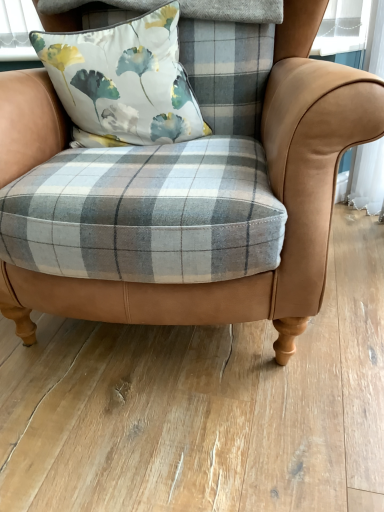
Question: Relative to matte plaid fabric chair at center, is floral fabric cushion at upper center in front or behind?

Choices:
 (A) behind
 (B) front

Answer: (A)

Question: From a real-world perspective, relative to matte plaid fabric chair at center, is floral fabric cushion at upper center vertically above or below?

Choices:
 (A) above
 (B) below

Answer: (A)

Question: In terms of height, does floral fabric cushion at upper center look taller or shorter compared to matte plaid fabric chair at center?

Choices:
 (A) short
 (B) tall

Answer: (A)

Question: From the image's perspective, is matte plaid fabric chair at center above or below floral fabric cushion at upper center?

Choices:
 (A) below
 (B) above

Answer: (A)

Question: Would you say matte plaid fabric chair at center is to the left or to the right of floral fabric cushion at upper center in the picture?

Choices:
 (A) left
 (B) right

Answer: (B)

Question: Looking at the image, does matte plaid fabric chair at center seem bigger or smaller compared to floral fabric cushion at upper center?

Choices:
 (A) small
 (B) big

Answer: (B)

Question: Considering their positions, is matte plaid fabric chair at center located in front of or behind floral fabric cushion at upper center?

Choices:
 (A) front
 (B) behind

Answer: (A)